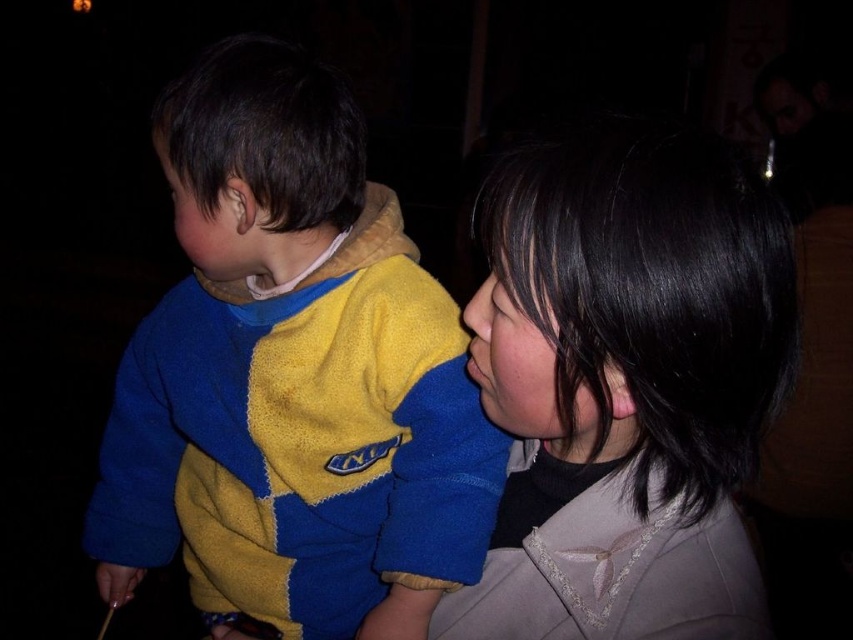
Can you confirm if yellow fleece sweater at left is positioned above smooth black hair at upper right?

Actually, yellow fleece sweater at left is below smooth black hair at upper right.

Measure the distance between point (178, 502) and camera.

Point (178, 502) is 1.01 meters from camera.

The height and width of the screenshot is (640, 853). In order to click on yellow fleece sweater at left in this screenshot , I will do `click(292, 376)`.